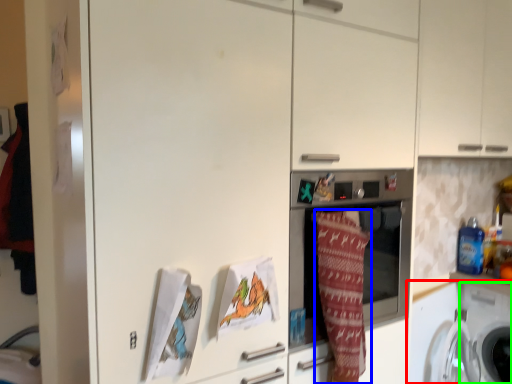
Question: Considering the real-world distances, which object is closest to washing machine (highlighted by a red box)? blanket (highlighted by a blue box) or washing machine (highlighted by a green box).

Choices:
 (A) blanket
 (B) washing machine

Answer: (B)